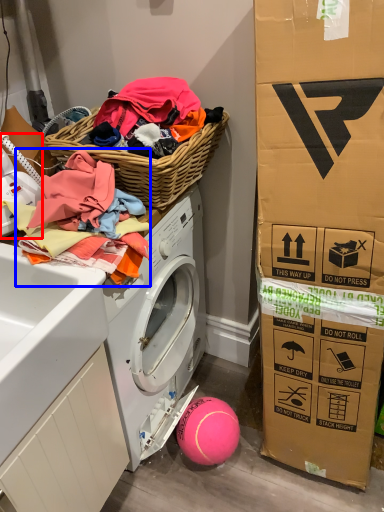
Question: Which object appears closest to the camera in this image, washer (highlighted by a red box) or clothing (highlighted by a blue box)?

Choices:
 (A) washer
 (B) clothing

Answer: (B)